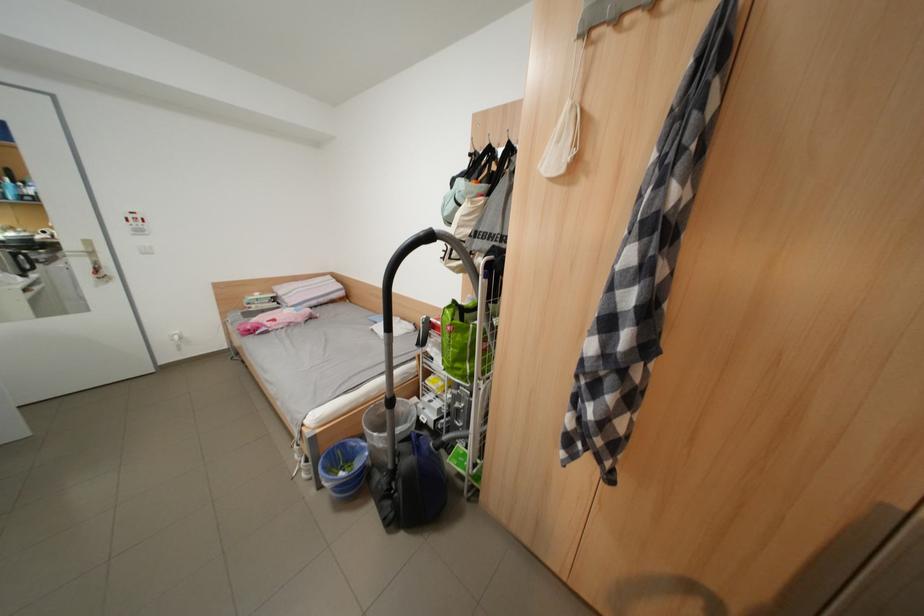
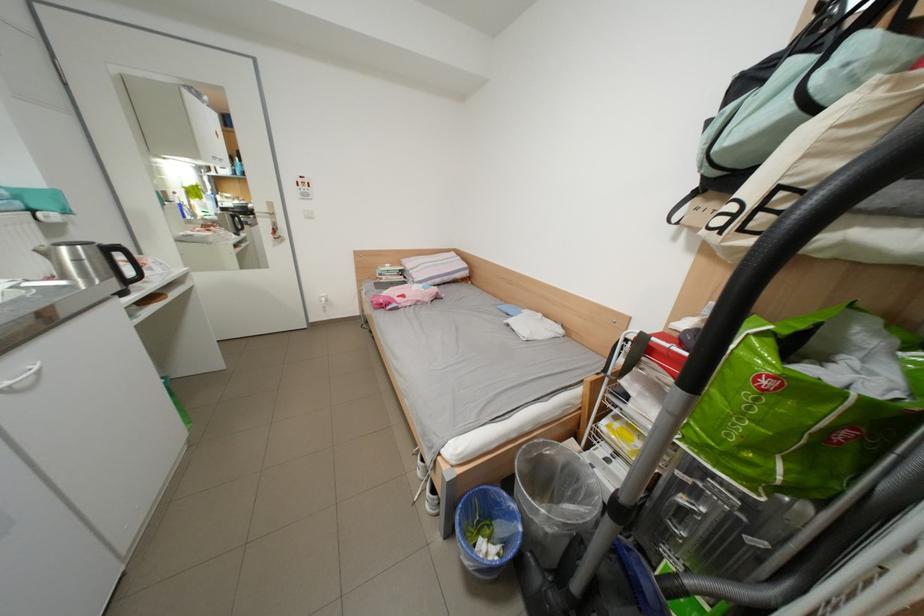
Find the pixel in the second image that matches (x=467, y=206) in the first image.

(801, 111)